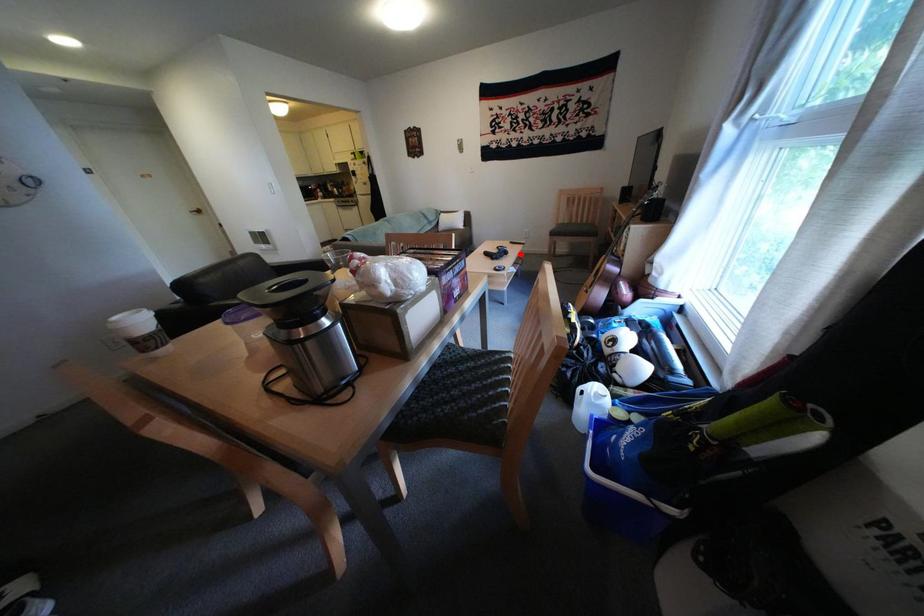
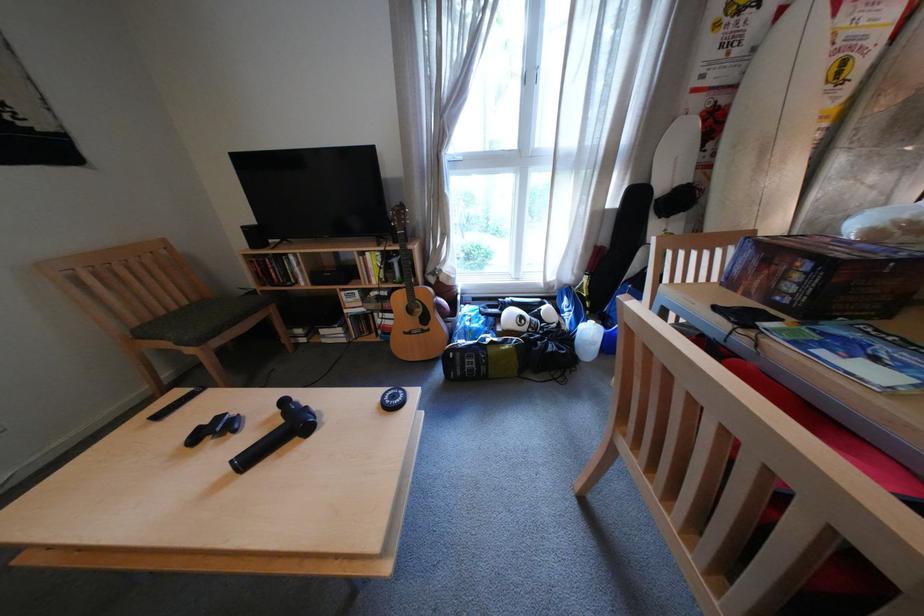
Question: I am providing you with two images of the same scene from different viewpoints. A red point is shown in image1. For the corresponding object point in image2, is it positioned nearer or farther from the camera?

Choices:
 (A) Nearer
 (B) Farther

Answer: (A)